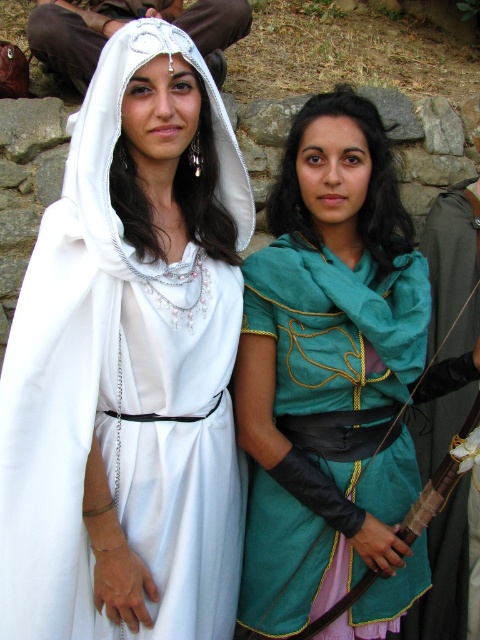
Question: Based on their relative distances, which object is nearer to the teal satin tunic at center?

Choices:
 (A) teal fabric dress at center
 (B) matte white dress at center
 (C) white satin headdress at upper center

Answer: (A)

Question: Can you confirm if matte white dress at center is bigger than white satin headdress at upper center?

Choices:
 (A) yes
 (B) no

Answer: (A)

Question: Can you confirm if teal fabric dress at center is positioned below white satin headdress at upper center?

Choices:
 (A) no
 (B) yes

Answer: (B)

Question: Which object is the farthest from the teal fabric dress at center?

Choices:
 (A) teal satin tunic at center
 (B) matte white dress at center

Answer: (A)

Question: Based on their relative distances, which object is farther from the matte white dress at center?

Choices:
 (A) white satin headdress at upper center
 (B) teal fabric dress at center

Answer: (A)

Question: Can you confirm if matte white dress at center is positioned to the right of teal fabric dress at center?

Choices:
 (A) yes
 (B) no

Answer: (B)